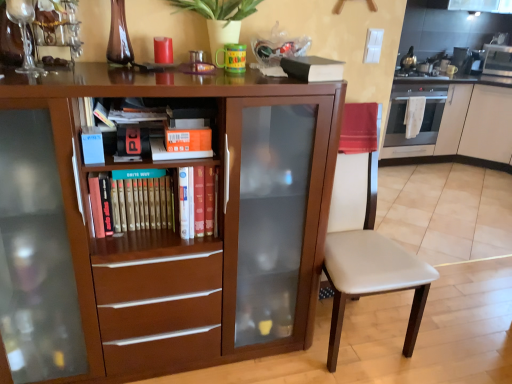
The height and width of the screenshot is (384, 512). In order to click on vacant space underneath white leather chair at center (from a real-world perspective) in this screenshot , I will do `click(355, 331)`.